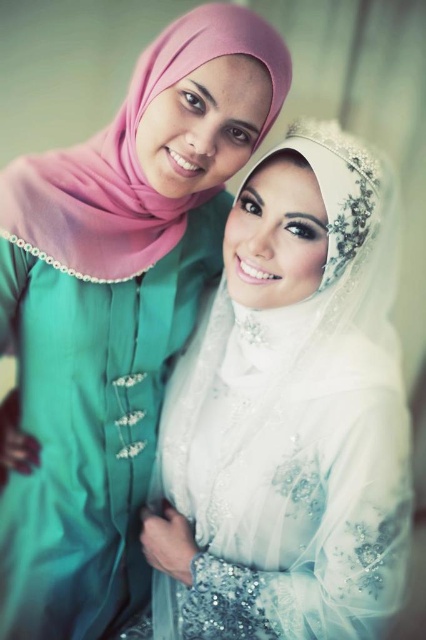
Can you confirm if satin white veil at center is taller than white sheer veil at upper center?

Yes, satin white veil at center is taller than white sheer veil at upper center.

Does satin white veil at center have a lesser width compared to white sheer veil at upper center?

No, satin white veil at center is not thinner than white sheer veil at upper center.

Which is in front, point (302, 298) or point (100, 180)?

Point (100, 180) is in front.

At what (x,y) coordinates should I click in order to perform the action: click on satin white veil at center. Please return your answer as a coordinate pair (x, y). Image resolution: width=426 pixels, height=640 pixels. Looking at the image, I should click on (290, 413).

Is matte pink hijab at upper left positioned before white sheer veil at upper center?

No, matte pink hijab at upper left is behind white sheer veil at upper center.

Does point (118, 305) come in front of point (28, 168)?

No, (118, 305) is further to viewer.

Between point (215, 209) and point (106, 164), which one is positioned in front?

Point (106, 164) is in front.

Locate an element on the screen. matte pink hijab at upper left is located at coordinates (112, 320).

Does satin white veil at center have a lesser height compared to matte pink hijab at upper left?

Yes, satin white veil at center is shorter than matte pink hijab at upper left.

Is point (253, 419) less distant than point (89, 616)?

Yes, it is.

Where is `satin white veil at center`? This screenshot has width=426, height=640. satin white veil at center is located at coordinates (290, 413).